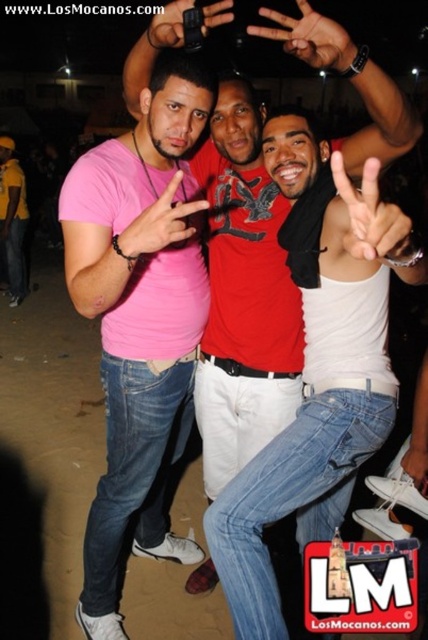
Measure the distance between matte red shirt at center and matte black phone at upper center.

matte red shirt at center is 1.09 meters from matte black phone at upper center.

Can you confirm if matte red shirt at center is positioned to the left of matte black phone at upper center?

Incorrect, matte red shirt at center is not on the left side of matte black phone at upper center.

Who is more distant from viewer, [329,400] or [169,17]?

Point [329,400]

At what (x,y) coordinates should I click in order to perform the action: click on matte red shirt at center. Please return your answer as a coordinate pair (x, y). Image resolution: width=428 pixels, height=640 pixels. Looking at the image, I should click on (315, 369).

Is white matte hand at center smaller than matte black phone at upper center?

→ No, white matte hand at center is not smaller than matte black phone at upper center.

What do you see at coordinates (368, 218) in the screenshot?
I see `white matte hand at center` at bounding box center [368, 218].

Is point (371, 250) farther from viewer compared to point (211, 3)?

No, (371, 250) is in front of (211, 3).

Find the location of a particular element. The height and width of the screenshot is (640, 428). white matte hand at center is located at coordinates (368, 218).

Which is above, pink matte t-shirt at left or pink matte shirt at center?

pink matte shirt at center is above.

Does pink matte t-shirt at left have a larger size compared to pink matte shirt at center?

Correct, pink matte t-shirt at left is larger in size than pink matte shirt at center.

Find the location of a particular element. This screenshot has height=640, width=428. pink matte t-shirt at left is located at coordinates (139, 320).

At what (x,y) coordinates should I click in order to perform the action: click on pink matte t-shirt at left. Please return your answer as a coordinate pair (x, y). The height and width of the screenshot is (640, 428). Looking at the image, I should click on (139, 320).